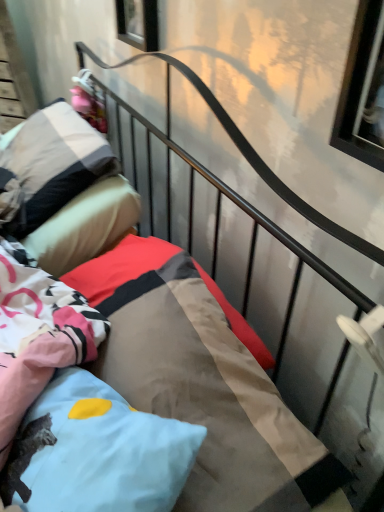
Question: Can you confirm if soft cotton pillow at upper left, which appears as the 1th pillow when viewed from the back, is positioned to the left of pink fabric doll at upper left?

Choices:
 (A) yes
 (B) no

Answer: (A)

Question: Is soft cotton pillow at upper left, which appears as the 1th pillow when viewed from the back, positioned beyond the bounds of pink fabric doll at upper left?

Choices:
 (A) yes
 (B) no

Answer: (A)

Question: From the image's perspective, does soft cotton pillow at upper left, which is the 1th pillow in top-to-bottom order, appear lower than pink fabric doll at upper left?

Choices:
 (A) no
 (B) yes

Answer: (B)

Question: Considering the relative sizes of soft cotton pillow at upper left, marked as the second pillow in a bottom-to-top arrangement, and pink fabric doll at upper left in the image provided, is soft cotton pillow at upper left, marked as the second pillow in a bottom-to-top arrangement, shorter than pink fabric doll at upper left?

Choices:
 (A) yes
 (B) no

Answer: (B)

Question: Would you say soft cotton pillow at upper left, which is the 1th pillow in top-to-bottom order, contains pink fabric doll at upper left?

Choices:
 (A) no
 (B) yes

Answer: (A)

Question: From a real-world perspective, is soft cotton pillow at upper left, which is the 1th pillow in top-to-bottom order, over pink fabric doll at upper left?

Choices:
 (A) yes
 (B) no

Answer: (B)

Question: Can you confirm if textured cotton mattress at center is bigger than clear glass window at upper right, which is the 2th window from top to bottom?

Choices:
 (A) yes
 (B) no

Answer: (A)

Question: Is textured cotton mattress at center facing away from clear glass window at upper right, acting as the first window starting from the bottom?

Choices:
 (A) yes
 (B) no

Answer: (B)

Question: Is textured cotton mattress at center positioned behind clear glass window at upper right, which is the 2th window from top to bottom?

Choices:
 (A) no
 (B) yes

Answer: (B)

Question: Is textured cotton mattress at center next to clear glass window at upper right, which is the 2th window in back-to-front order?

Choices:
 (A) yes
 (B) no

Answer: (B)

Question: Would you say clear glass window at upper right, acting as the 2th window starting from the left, is part of textured cotton mattress at center's contents?

Choices:
 (A) no
 (B) yes

Answer: (A)

Question: Is the position of textured cotton mattress at center less distant than that of clear glass window at upper right, which is the 2th window from top to bottom?

Choices:
 (A) yes
 (B) no

Answer: (B)

Question: Considering the relative sizes of textured cotton mattress at center and pink fabric doll at upper left in the image provided, is textured cotton mattress at center wider than pink fabric doll at upper left?

Choices:
 (A) yes
 (B) no

Answer: (A)